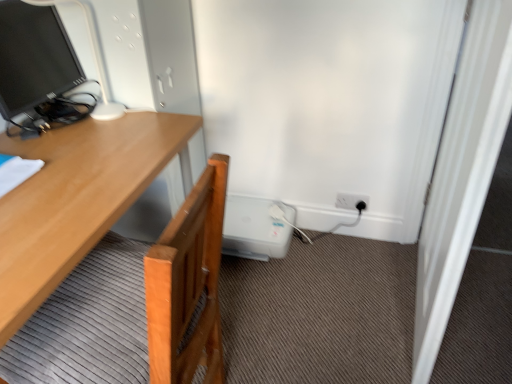
Question: From the image's perspective, does matte black monitor at upper left appear higher than light wood desk at left?

Choices:
 (A) yes
 (B) no

Answer: (A)

Question: Does matte black monitor at upper left have a lesser width compared to light wood desk at left?

Choices:
 (A) no
 (B) yes

Answer: (B)

Question: Can you confirm if matte black monitor at upper left is positioned to the right of light wood desk at left?

Choices:
 (A) yes
 (B) no

Answer: (B)

Question: Would you consider matte black monitor at upper left to be distant from light wood desk at left?

Choices:
 (A) yes
 (B) no

Answer: (B)

Question: From the image's perspective, does matte black monitor at upper left appear lower than light wood desk at left?

Choices:
 (A) yes
 (B) no

Answer: (B)

Question: Does matte black monitor at upper left have a greater height compared to light wood desk at left?

Choices:
 (A) no
 (B) yes

Answer: (A)

Question: Is matte black monitor at upper left surrounded by white wooden screen door at right?

Choices:
 (A) yes
 (B) no

Answer: (B)

Question: Is white wooden screen door at right to the right of matte black monitor at upper left from the viewer's perspective?

Choices:
 (A) yes
 (B) no

Answer: (A)

Question: Is white wooden screen door at right wider than matte black monitor at upper left?

Choices:
 (A) yes
 (B) no

Answer: (B)

Question: Is white wooden screen door at right at the left side of matte black monitor at upper left?

Choices:
 (A) no
 (B) yes

Answer: (A)

Question: Does white wooden screen door at right lie in front of matte black monitor at upper left?

Choices:
 (A) no
 (B) yes

Answer: (B)

Question: Is white wooden screen door at right not inside matte black monitor at upper left?

Choices:
 (A) no
 (B) yes

Answer: (B)

Question: Is black plastic power outlet at lower right wider than white wooden screen door at right?

Choices:
 (A) no
 (B) yes

Answer: (A)